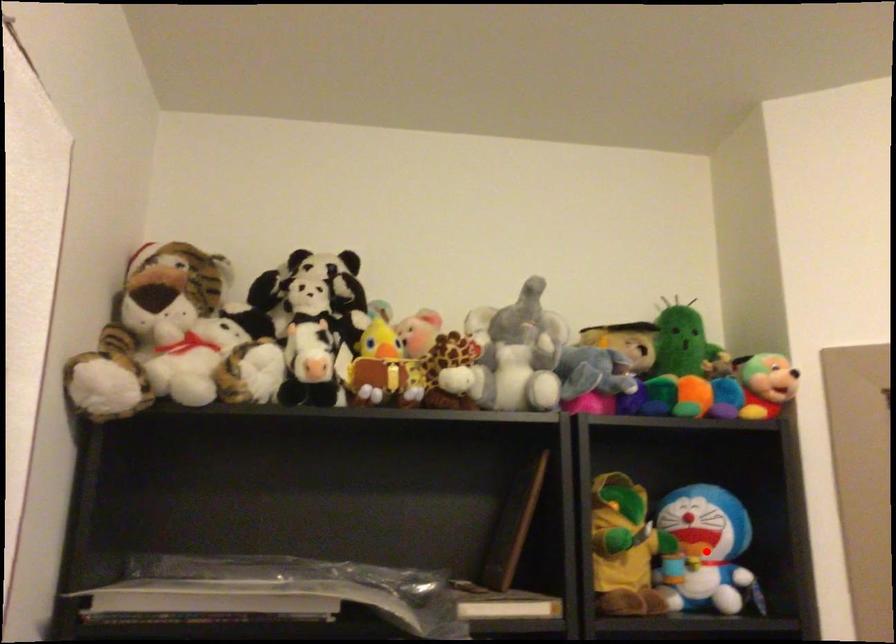
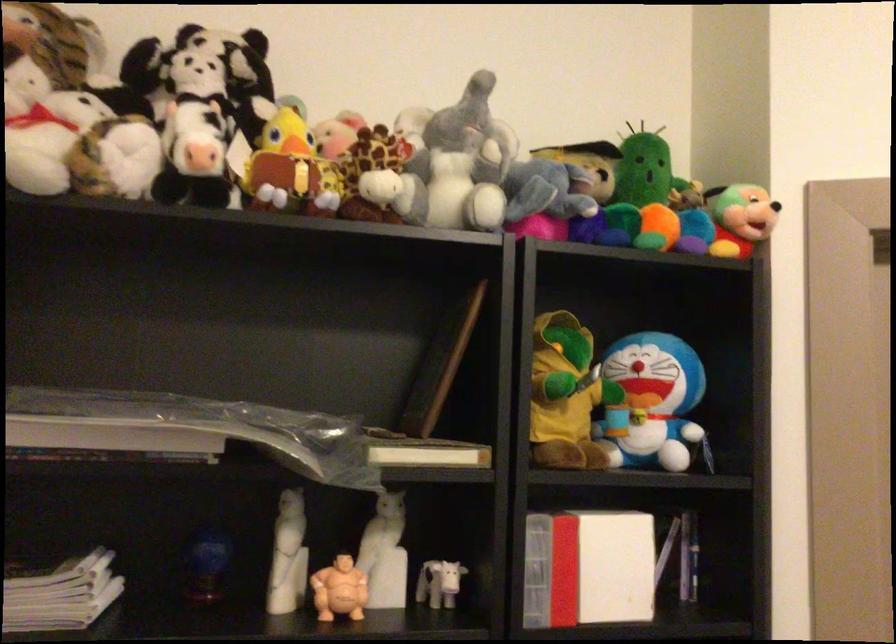
Locate, in the second image, the point that corresponds to the highlighted location in the first image.

(651, 402)